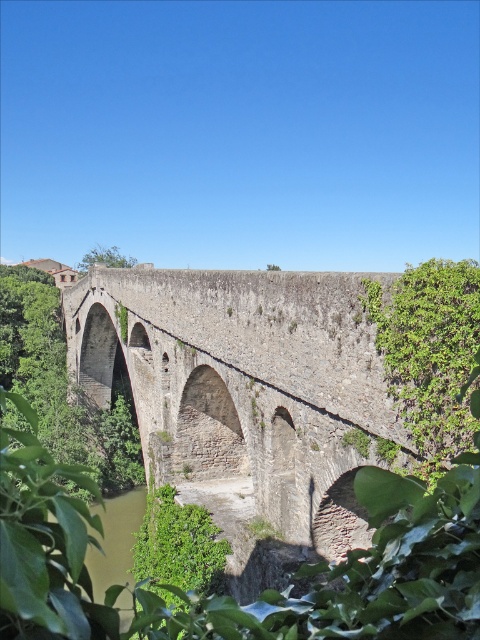
You are standing on the historic stone bridge and looking towards the center. What do you see at the point marked by the coordinates (280, 449)?

At the coordinates (280, 449), there is green leafy vegetation at center.

You are an environmental scientist assessing the vegetation coverage around the historic stone bridge. Which area has a larger width between the green leafy vegetation at center and the green leafy vegetation at lower left?

The green leafy vegetation at center might be wider than green leafy vegetation at lower left according to the description.

You are standing on the historic stone bridge and want to take a photo. There are two points of interest marked as point 1 at coordinates (435,300) and point 2 at coordinates (177,534). Which point should you focus on to capture the closest object in your shot?

Point 1 at coordinates (435,300) is closer to the camera, so focusing on this point will capture the closest object in your shot.